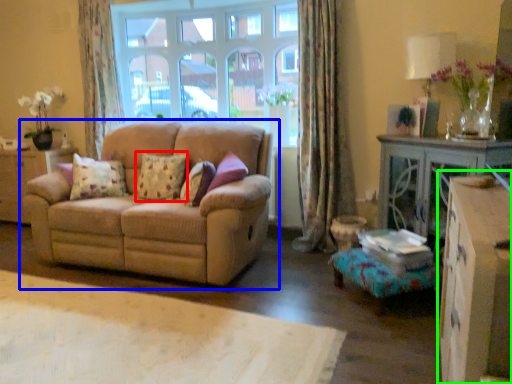
Question: Which object is the farthest from pillow (highlighted by a red box)? Choose among these: studio couch (highlighted by a blue box) or dresser (highlighted by a green box).

Choices:
 (A) studio couch
 (B) dresser

Answer: (B)